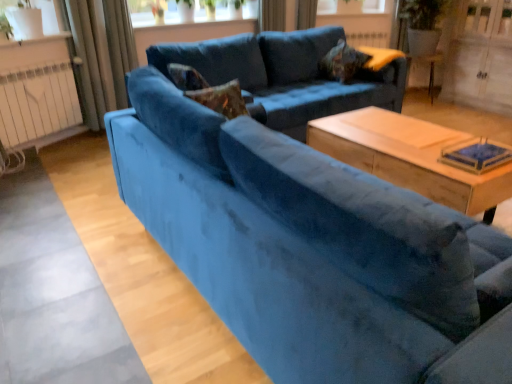
Measure the distance between wooden coffee table at center and camera.

They are 1.95 meters apart.

Identify the location of velvet textured pillow at upper center. (342, 62).

Where is `velvet curtain at left, which appears as the third curtain when viewed from the right`? This screenshot has height=384, width=512. velvet curtain at left, which appears as the third curtain when viewed from the right is located at coordinates (102, 54).

The height and width of the screenshot is (384, 512). What do you see at coordinates (120, 46) in the screenshot? I see `velvet curtain at upper center, which is counted as the second curtain, starting from the left` at bounding box center [120, 46].

What is the approximate width of white matte radiator at left?

The width of white matte radiator at left is 10.13 centimeters.

Find the location of a particular element. The image size is (512, 384). velvet blue curtain at upper center, which is counted as the 1th curtain, starting from the right is located at coordinates (306, 14).

Who is smaller, white wood screen door at upper right or velvet blue curtain at upper center, which is counted as the 1th curtain, starting from the right?

velvet blue curtain at upper center, which is counted as the 1th curtain, starting from the right.

In terms of width, does white wood screen door at upper right look wider or thinner when compared to velvet blue curtain at upper center, which is counted as the 1th curtain, starting from the right?

Considering their sizes, white wood screen door at upper right looks broader than velvet blue curtain at upper center, which is counted as the 1th curtain, starting from the right.

Is white wood screen door at upper right in contact with velvet blue curtain at upper center, which is counted as the 1th curtain, starting from the right?

No, white wood screen door at upper right is not beside velvet blue curtain at upper center, which is counted as the 1th curtain, starting from the right.

Considering the positions of objects white wood screen door at upper right and velvet blue curtain at upper center, which is counted as the 1th curtain, starting from the right, in the image provided, who is behind, white wood screen door at upper right or velvet blue curtain at upper center, which is counted as the 1th curtain, starting from the right,?

velvet blue curtain at upper center, which is counted as the 1th curtain, starting from the right, is more distant.

Measure the distance from velvet curtain at left, the 1th curtain in the left-to-right sequence, to velvet curtain at upper center, which is counted as the second curtain, starting from the left.

The distance of velvet curtain at left, the 1th curtain in the left-to-right sequence, from velvet curtain at upper center, which is counted as the second curtain, starting from the left, is 3.72 inches.

Is velvet curtain at left, the 1th curtain in the left-to-right sequence, in front of or behind velvet curtain at upper center, which is counted as the second curtain, starting from the left, in the image?

In the image, velvet curtain at left, the 1th curtain in the left-to-right sequence, appears in front of velvet curtain at upper center, which is counted as the second curtain, starting from the left.

From the picture: Considering the relative sizes of velvet curtain at left, the 1th curtain in the left-to-right sequence, and velvet curtain at upper center, which is counted as the second curtain, starting from the left, in the image provided, is velvet curtain at left, the 1th curtain in the left-to-right sequence, shorter than velvet curtain at upper center, which is counted as the second curtain, starting from the left,?

No, velvet curtain at left, the 1th curtain in the left-to-right sequence, is not shorter than velvet curtain at upper center, which is counted as the second curtain, starting from the left.

Which is more to the left, velvet curtain at left, which appears as the third curtain when viewed from the right, or velvet curtain at upper center, which is counted as the second curtain, starting from the left?

velvet curtain at left, which appears as the third curtain when viewed from the right, is more to the left.

Is velvet blue couch at center, which is counted as the first studio couch, starting from the front, to the left of velvet blue couch at center, placed as the first studio couch when sorted from back to front, from the viewer's perspective?

Yes.

Consider the image. Between velvet blue couch at center, which is counted as the first studio couch, starting from the front, and velvet blue couch at center, the 2th studio couch positioned from the front, which one has smaller width?

Thinner between the two is velvet blue couch at center, the 2th studio couch positioned from the front.

Is the depth of velvet blue couch at center, the second studio couch in the back-to-front sequence, greater than that of velvet blue couch at center, the 2th studio couch positioned from the front?

No, velvet blue couch at center, the second studio couch in the back-to-front sequence, is closer to the viewer.

Would you say velvet curtain at left, which appears as the third curtain when viewed from the right, is inside or outside velvet textured pillow at upper center?

velvet curtain at left, which appears as the third curtain when viewed from the right, lies outside velvet textured pillow at upper center.

From the image's perspective, would you say velvet curtain at left, which appears as the third curtain when viewed from the right, is shown under velvet textured pillow at upper center?

Indeed, from the image's perspective, velvet curtain at left, which appears as the third curtain when viewed from the right, is shown beneath velvet textured pillow at upper center.

Who is bigger, velvet curtain at left, which appears as the third curtain when viewed from the right, or velvet textured pillow at upper center?

With larger size is velvet curtain at left, which appears as the third curtain when viewed from the right.

Is velvet curtain at left, the 1th curtain in the left-to-right sequence, positioned in front of velvet textured pillow at upper center?

Yes, velvet curtain at left, the 1th curtain in the left-to-right sequence, is closer to the viewer.

From a real-world perspective, relative to clear glass window screen at upper center, is velvet curtain at left, the 1th curtain in the left-to-right sequence, vertically above or below?

velvet curtain at left, the 1th curtain in the left-to-right sequence, is situated lower than clear glass window screen at upper center in the real world.

Is velvet curtain at left, the 1th curtain in the left-to-right sequence, placed right next to clear glass window screen at upper center?

velvet curtain at left, the 1th curtain in the left-to-right sequence, and clear glass window screen at upper center are clearly separated.

Can you confirm if velvet curtain at left, the 1th curtain in the left-to-right sequence, is taller than clear glass window screen at upper center?

Indeed, velvet curtain at left, the 1th curtain in the left-to-right sequence, has a greater height compared to clear glass window screen at upper center.

Is point (113, 55) closer to viewer compared to point (328, 2)?

That is True.

From the picture: Considering the relative sizes of white wood screen door at upper right and velvet curtain at left, which appears as the third curtain when viewed from the right, in the image provided, is white wood screen door at upper right thinner than velvet curtain at left, which appears as the third curtain when viewed from the right,?

No.

Between white wood screen door at upper right and velvet curtain at left, the 1th curtain in the left-to-right sequence, which one appears on the right side from the viewer's perspective?

white wood screen door at upper right is more to the right.

From the image's perspective, is white wood screen door at upper right positioned above or below velvet curtain at left, which appears as the third curtain when viewed from the right?

Clearly, from the image's perspective, white wood screen door at upper right is above velvet curtain at left, which appears as the third curtain when viewed from the right.

Which of these two, white wood screen door at upper right or velvet curtain at left, the 1th curtain in the left-to-right sequence, is smaller?

With smaller size is velvet curtain at left, the 1th curtain in the left-to-right sequence.

Can wooden side table at right be found inside velvet blue curtain at upper center, which is counted as the 1th curtain, starting from the right?

No, wooden side table at right is located outside of velvet blue curtain at upper center, which is counted as the 1th curtain, starting from the right.

Considering the relative sizes of velvet blue curtain at upper center, the 3th curtain positioned from the left, and wooden side table at right in the image provided, is velvet blue curtain at upper center, the 3th curtain positioned from the left, shorter than wooden side table at right?

Yes.

In the scene shown: Is velvet blue curtain at upper center, which is counted as the 1th curtain, starting from the right, directly adjacent to wooden side table at right?

No, velvet blue curtain at upper center, which is counted as the 1th curtain, starting from the right, is not making contact with wooden side table at right.

Looking at this image, is velvet blue curtain at upper center, the 3th curtain positioned from the left, turned away from wooden side table at right?

No.

This screenshot has height=384, width=512. In order to click on screen door below the velvet blue curtain at upper center, the 3th curtain positioned from the left (from a real-world perspective) in this screenshot , I will do `click(481, 57)`.

Where is `the 1st curtain located above the velvet curtain at left, which appears as the third curtain when viewed from the right (from a real-world perspective)`? The image size is (512, 384). the 1st curtain located above the velvet curtain at left, which appears as the third curtain when viewed from the right (from a real-world perspective) is located at coordinates (120, 46).

When comparing their distances from velvet textured pillow at upper center, does velvet blue couch at center, the second studio couch in the back-to-front sequence, or velvet curtain at upper center, which is counted as the second curtain, starting from the left, seem further?

The object further to velvet textured pillow at upper center is velvet blue couch at center, the second studio couch in the back-to-front sequence.

Considering their positions, is velvet blue couch at center, which is counted as the first studio couch, starting from the front, positioned further to velvet curtain at upper center, which is counted as the second curtain, starting from the left, than wooden side table at right?

The object further to velvet curtain at upper center, which is counted as the second curtain, starting from the left, is wooden side table at right.

Estimate the real-world distances between objects in this image. Which object is further from wooden coffee table at center, velvet textured pillow at upper center or white wood screen door at upper right?

Among the two, white wood screen door at upper right is located further to wooden coffee table at center.

Which object lies further to the anchor point wooden coffee table at center, velvet blue couch at center, placed as the first studio couch when sorted from back to front, or clear glass window screen at upper center?

clear glass window screen at upper center is further to wooden coffee table at center.

From the image, which object appears to be nearer to velvet curtain at upper center, positioned as the second curtain in right-to-left order, wooden side table at right or wooden coffee table at center?

wooden coffee table at center is positioned closer to the anchor velvet curtain at upper center, positioned as the second curtain in right-to-left order.

Based on their spatial positions, is velvet blue couch at center, placed as the first studio couch when sorted from back to front, or velvet textured pillow at upper center further from wooden coffee table at center?

Among the two, velvet textured pillow at upper center is located further to wooden coffee table at center.

Looking at the image, which one is located further to velvet blue couch at center, which is counted as the first studio couch, starting from the front, clear glass window screen at upper center or velvet curtain at left, which appears as the third curtain when viewed from the right?

clear glass window screen at upper center lies further to velvet blue couch at center, which is counted as the first studio couch, starting from the front, than the other object.

Considering their positions, is velvet blue curtain at upper center, the 3th curtain positioned from the left, positioned further to white wood screen door at upper right than velvet blue couch at center, the 2th studio couch positioned from the front?

velvet blue curtain at upper center, the 3th curtain positioned from the left, is further to white wood screen door at upper right.

This screenshot has height=384, width=512. I want to click on pillow located between velvet blue couch at center, placed as the first studio couch when sorted from back to front, and clear glass window screen at upper center in the depth direction, so click(x=342, y=62).

This screenshot has width=512, height=384. I want to click on pillow between velvet curtain at left, which appears as the third curtain when viewed from the right, and wooden coffee table at center, in the horizontal direction, so click(x=342, y=62).

In order to click on table between white matte radiator at left and wooden side table at right in the horizontal direction in this screenshot , I will do `click(410, 157)`.

At what (x,y) coordinates should I click in order to perform the action: click on side table situated between velvet curtain at left, the 1th curtain in the left-to-right sequence, and white wood screen door at upper right from left to right. Please return your answer as a coordinate pair (x, y). Looking at the image, I should click on (430, 68).